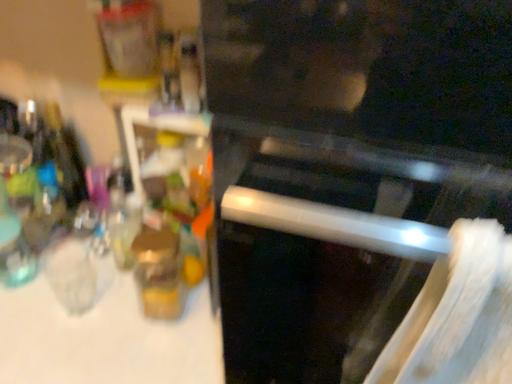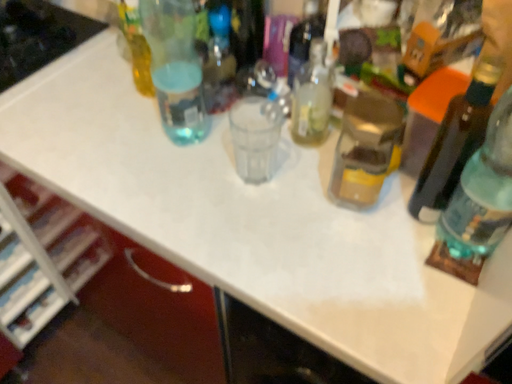
Question: How did the camera likely rotate when shooting the video?

Choices:
 (A) rotated right
 (B) rotated left

Answer: (B)